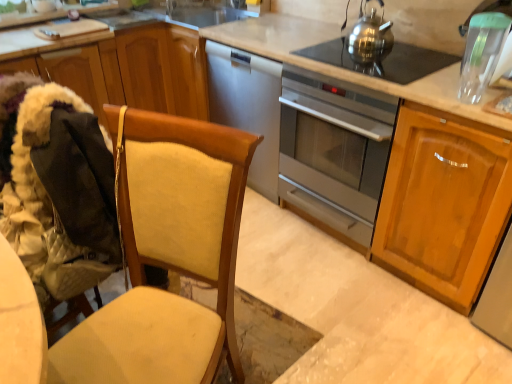
Question: Does point (27, 157) appear closer or farther from the camera than point (379, 59)?

Choices:
 (A) closer
 (B) farther

Answer: (A)

Question: Is beige fabric folding chair at left bigger or smaller than polished stainless steel gas stove at upper center?

Choices:
 (A) small
 (B) big

Answer: (B)

Question: Estimate the real-world distances between objects in this image. Which object is farther from the transparent plastic container at upper right?

Choices:
 (A) wooden cabinet at left, acting as the first cabinetry starting from the left
 (B) beige fabric folding chair at left
 (C) polished stainless steel gas stove at upper center
 (D) shiny metallic kettle at upper right
 (E) satin silver oven at center

Answer: (A)

Question: Estimate the real-world distances between objects in this image. Which object is closer to the light brown wood cabinet at right, which is the 1th cabinetry in right-to-left order?

Choices:
 (A) beige fabric folding chair at left
 (B) polished stainless steel gas stove at upper center
 (C) wooden cabinet at left, acting as the first cabinetry starting from the left
 (D) transparent plastic container at upper right
 (E) shiny metallic kettle at upper right

Answer: (D)